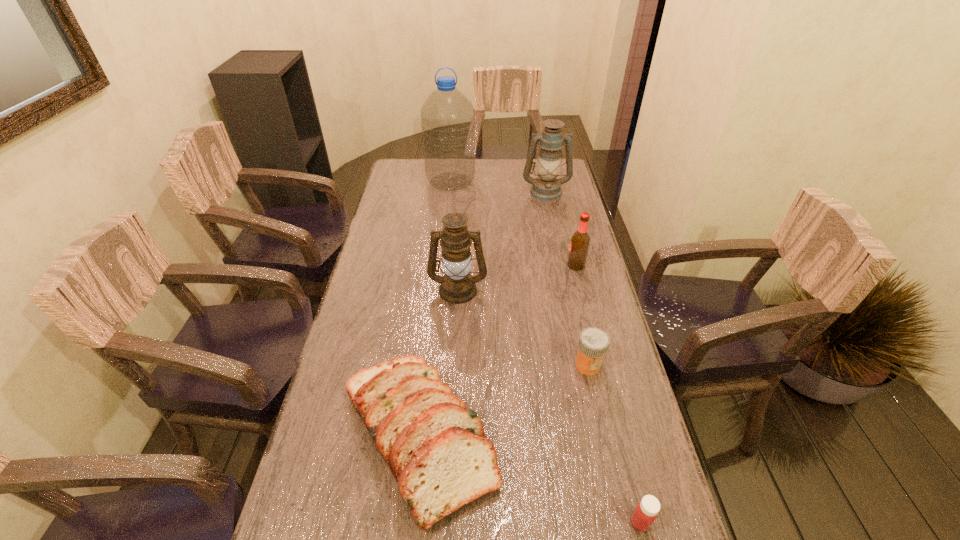
The image size is (960, 540). Find the location of `free space between the right oil lamp and the tallest object`. free space between the right oil lamp and the tallest object is located at coordinates (498, 186).

The image size is (960, 540). What are the coordinates of `empty space that is in between the beer bottle and the tallest object` in the screenshot? It's located at (514, 224).

Identify the location of free space between the farther medicine and the beer bottle. This screenshot has width=960, height=540. (582, 315).

You are a GUI agent. You are given a task and a screenshot of the screen. Output one action in this format:
    pyautogui.click(x=<x>, y=<y>)
    Task: Click on the vacant space that's between the taller medicine and the shortest object
    
    Given the screenshot: What is the action you would take?
    pyautogui.click(x=613, y=444)

Where is `unoccupied position between the taller medicine and the third farthest object`? This screenshot has width=960, height=540. unoccupied position between the taller medicine and the third farthest object is located at coordinates (582, 315).

At what (x,y) coordinates should I click in order to perform the action: click on free space that is in between the fourth tallest object and the shortest object. Please return your answer as a coordinate pair (x, y). Image resolution: width=960 pixels, height=540 pixels. Looking at the image, I should click on (608, 394).

The height and width of the screenshot is (540, 960). Identify the location of free space between the taller medicine and the beer bottle. (582, 315).

Image resolution: width=960 pixels, height=540 pixels. I want to click on free space between the beer bottle and the left oil lamp, so click(x=517, y=278).

Locate an element on the screen. Image resolution: width=960 pixels, height=540 pixels. vacant area that lies between the second shortest object and the third shortest object is located at coordinates (503, 401).

Where is `unoccupied area between the nearer medicine and the left oil lamp`? unoccupied area between the nearer medicine and the left oil lamp is located at coordinates (549, 406).